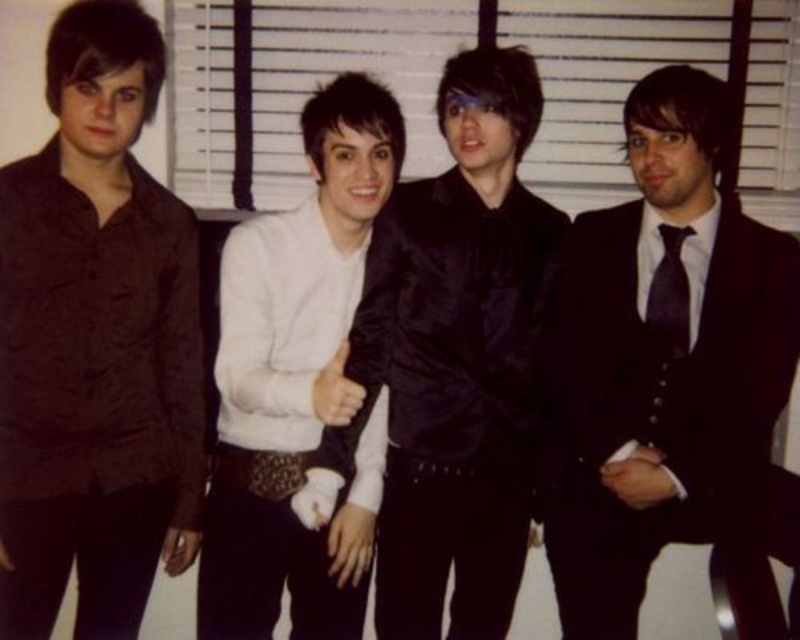
You are taking a photo of the group and want to focus on both the point at point (336, 236) and the point at point (656, 273). Which point should you focus on first to ensure both are in focus?

You should focus on point (336, 236) first because it is closer to the camera than point (656, 273). By focusing on the closer point, the depth of field may also keep the farther point in focus.

You are a photographer setting up for a group photo. You notice the white matte shirt at center and the black satin tie at right. Which one is positioned more to the left side of the image?

The white matte shirt at center is positioned more to the left side of the image than the black satin tie at right.